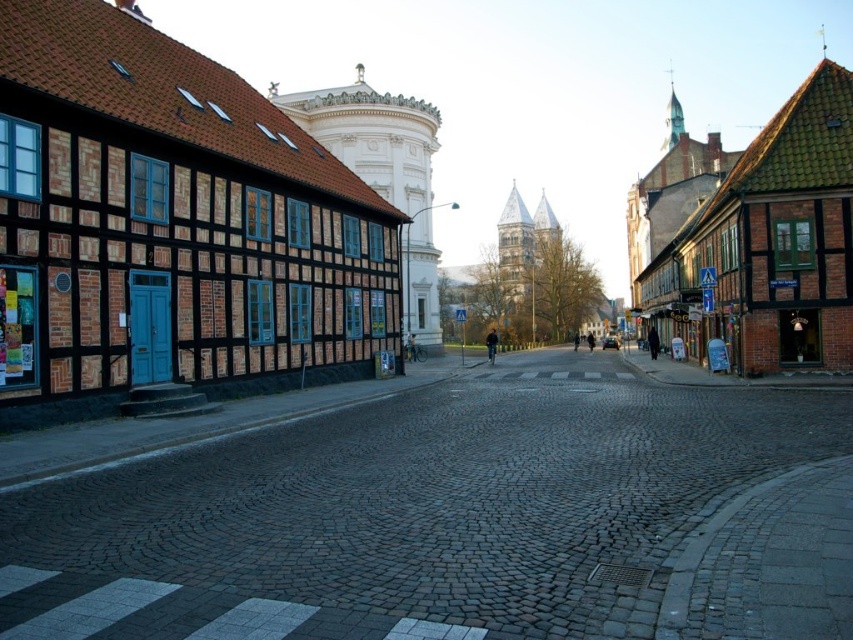
You are a tourist standing at the pedestrian crossing on the cobblestone street. You see the brown wooden building at left and the brown wooden house at right. Which one is closer to you?

The brown wooden building at left is closer to you because it is positioned over the brown wooden house at right, indicating it is in front.

You are a tourist standing at the pedestrian crossing in the middle of the cobblestone street. You want to take a photo that includes both the matte brick building at left and the brown wooden house at right. Which building should you position closer to in order to fit both in your camera frame?

Since the matte brick building at left is narrower than the brown wooden house at right, you should position closer to the wider brown wooden house at right to ensure both buildings are visible in the frame.

You are standing at the center of the cobblestone street in the image. Which direction should you walk to reach the matte brick building at left?

To reach the matte brick building at left, you should walk to the left since it is positioned at point 0.356 on the x axis, which is to the left of the center point at 0.5.